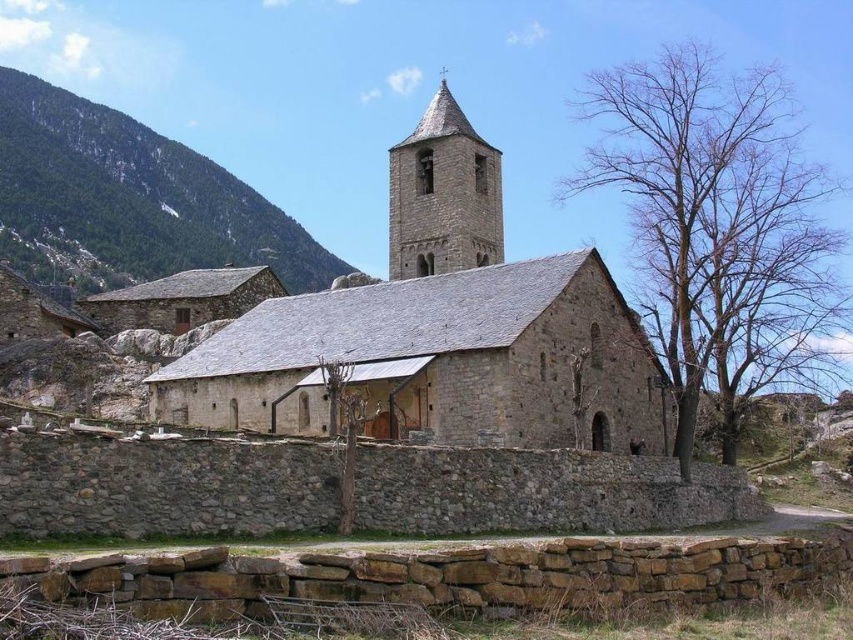
You are standing at the entrance of the church and want to take a photo of the green forested mountain at upper left. Where should you position yourself to ensure the mountain is centered in your camera view?

Since the green forested mountain at upper left is located at coordinates 0.312 on the x and 0.152 on the y axis, you should position yourself so that your camera is aligned with those coordinates to center the mountain in your view.

You are standing at the entrance of the stone church and looking towards the bell tower. There is a point marked at coordinates (129, 198). Based on the scene description, what does this point most likely represent?

The point at coordinates (129, 198) indicates the green forested mountain at upper left.